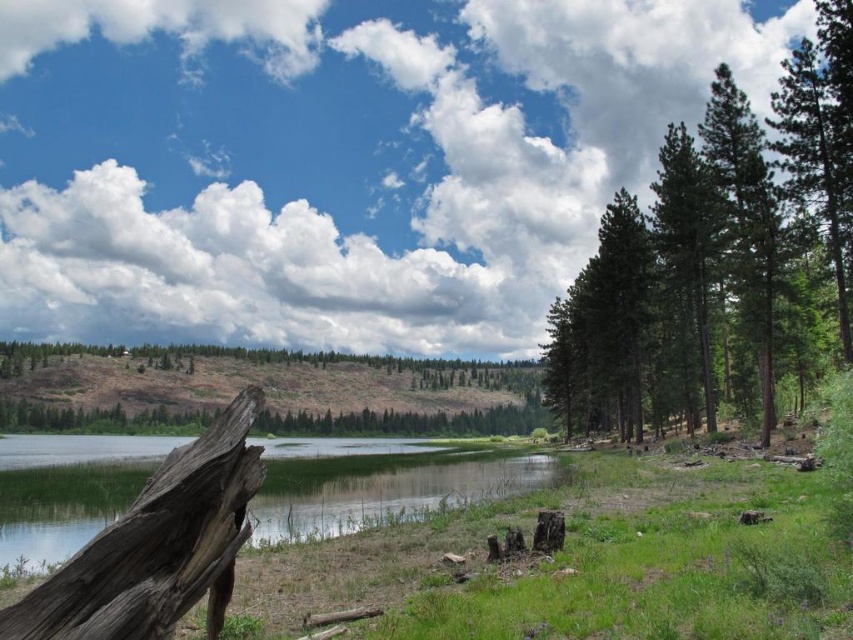
Looking at this image, you are a kayaker approaching the clear water at lower left. As you paddle towards it, you notice the green textured pine trees at right. Based on their position relative to the water, which direction should you head to stay in the clear water area?

The green textured pine trees at right are positioned over clear water at lower left, so to stay in the clear water area, you should head towards the direction away from the green textured pine trees at right since they are located above the water in the scene.

You are standing at the center of the scene and want to walk towards the clear water at lower left. Which direction should you walk to avoid the green textured pine trees at right?

Since the green textured pine trees at right are positioned on the right side of the clear water at lower left, you should walk towards the clear water at lower left while moving to the left to avoid the green textured pine trees at right.

You are a photographer aiming to capture the reflection of the green textured pine trees at right in the clear water at lower left. Will the entire tree be visible in the reflection?

The green textured pine trees at right is much taller than the clear water at lower left, so the reflection of the green textured pine trees at right in the clear water at lower left will not show the entire tree.